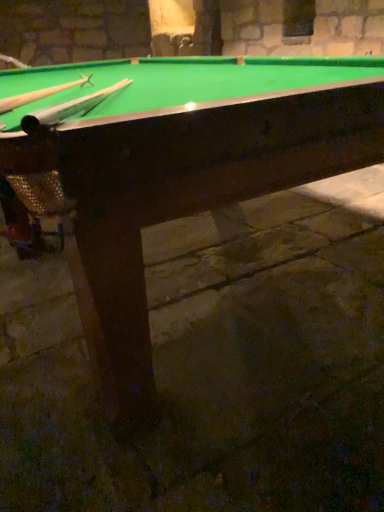
Question: From a real-world perspective, is wooden cue at upper left, which is the second cue in left-to-right order, on top of wooden cue at upper left, which is the 2th cue in right-to-left order?

Choices:
 (A) yes
 (B) no

Answer: (B)

Question: From a real-world perspective, is wooden cue at upper left, positioned as the 1th cue in right-to-left order, physically below wooden cue at upper left, which is the 2th cue in right-to-left order?

Choices:
 (A) yes
 (B) no

Answer: (A)

Question: Does wooden cue at upper left, which is the second cue in left-to-right order, appear on the left side of wooden cue at upper left, arranged as the 1th cue when viewed from the left?

Choices:
 (A) yes
 (B) no

Answer: (B)

Question: Is wooden cue at upper left, which is the second cue in left-to-right order, positioned with its back to wooden cue at upper left, which is the 2th cue in right-to-left order?

Choices:
 (A) no
 (B) yes

Answer: (A)

Question: Can you confirm if wooden cue at upper left, positioned as the 1th cue in right-to-left order, is wider than wooden cue at upper left, arranged as the 1th cue when viewed from the left?

Choices:
 (A) no
 (B) yes

Answer: (B)

Question: Considering the positions of green felt billiard table at center and wooden cue at upper left, positioned as the 1th cue in right-to-left order, in the image, is green felt billiard table at center bigger or smaller than wooden cue at upper left, positioned as the 1th cue in right-to-left order,?

Choices:
 (A) small
 (B) big

Answer: (B)

Question: From their relative heights in the image, would you say green felt billiard table at center is taller or shorter than wooden cue at upper left, which is the second cue in left-to-right order?

Choices:
 (A) tall
 (B) short

Answer: (A)

Question: Do you think green felt billiard table at center is within wooden cue at upper left, positioned as the 1th cue in right-to-left order, or outside of it?

Choices:
 (A) outside
 (B) inside

Answer: (A)

Question: Based on their positions, is green felt billiard table at center located to the left or right of wooden cue at upper left, positioned as the 1th cue in right-to-left order?

Choices:
 (A) left
 (B) right

Answer: (A)

Question: Considering the positions of wooden cue at upper left, positioned as the 1th cue in right-to-left order, and green felt billiard table at center in the image, is wooden cue at upper left, positioned as the 1th cue in right-to-left order, bigger or smaller than green felt billiard table at center?

Choices:
 (A) big
 (B) small

Answer: (B)

Question: Is wooden cue at upper left, which is the second cue in left-to-right order, situated inside green felt billiard table at center or outside?

Choices:
 (A) outside
 (B) inside

Answer: (B)

Question: From a real-world perspective, is wooden cue at upper left, which is the second cue in left-to-right order, above or below green felt billiard table at center?

Choices:
 (A) above
 (B) below

Answer: (A)

Question: Would you say wooden cue at upper left, positioned as the 1th cue in right-to-left order, is to the left or to the right of green felt billiard table at center in the picture?

Choices:
 (A) right
 (B) left

Answer: (A)

Question: Is green felt billiard table at center taller or shorter than wooden cue at upper left, arranged as the 1th cue when viewed from the left?

Choices:
 (A) short
 (B) tall

Answer: (B)

Question: Looking at their shapes, would you say green felt billiard table at center is wider or thinner than wooden cue at upper left, which is the 2th cue in right-to-left order?

Choices:
 (A) thin
 (B) wide

Answer: (B)